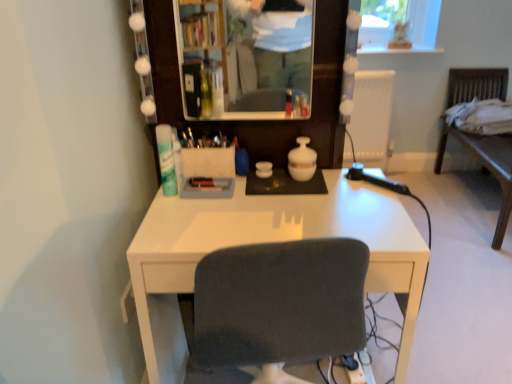
Question: From a real-world perspective, is wooden chair at right located higher than white plastic radiator at upper right?

Choices:
 (A) no
 (B) yes

Answer: (A)

Question: Can you confirm if wooden chair at right is thinner than white plastic radiator at upper right?

Choices:
 (A) no
 (B) yes

Answer: (A)

Question: Is wooden chair at right further to the viewer compared to white plastic radiator at upper right?

Choices:
 (A) yes
 (B) no

Answer: (B)

Question: From the image's perspective, would you say wooden chair at right is shown under white plastic radiator at upper right?

Choices:
 (A) yes
 (B) no

Answer: (A)

Question: Is wooden chair at right closer to camera compared to white plastic radiator at upper right?

Choices:
 (A) yes
 (B) no

Answer: (A)

Question: From a real-world perspective, is matte glass mirror at upper center positioned above or below wooden chair at right?

Choices:
 (A) above
 (B) below

Answer: (A)

Question: Is matte glass mirror at upper center inside or outside of wooden chair at right?

Choices:
 (A) outside
 (B) inside

Answer: (A)

Question: Is matte glass mirror at upper center taller or shorter than wooden chair at right?

Choices:
 (A) tall
 (B) short

Answer: (B)

Question: In terms of size, does matte glass mirror at upper center appear bigger or smaller than wooden chair at right?

Choices:
 (A) small
 (B) big

Answer: (A)

Question: Visually, is matte glass mirror at upper center positioned to the left or to the right of white matte deodorant at left?

Choices:
 (A) right
 (B) left

Answer: (A)

Question: Is matte glass mirror at upper center bigger or smaller than white matte deodorant at left?

Choices:
 (A) small
 (B) big

Answer: (B)

Question: Relative to white matte deodorant at left, is matte glass mirror at upper center in front or behind?

Choices:
 (A) front
 (B) behind

Answer: (A)

Question: In terms of height, does matte glass mirror at upper center look taller or shorter compared to white matte deodorant at left?

Choices:
 (A) short
 (B) tall

Answer: (B)

Question: Would you say matte glass mirror at upper center is to the left or to the right of white plastic radiator at upper right in the picture?

Choices:
 (A) right
 (B) left

Answer: (B)

Question: Looking at the image, does matte glass mirror at upper center seem bigger or smaller compared to white plastic radiator at upper right?

Choices:
 (A) small
 (B) big

Answer: (A)